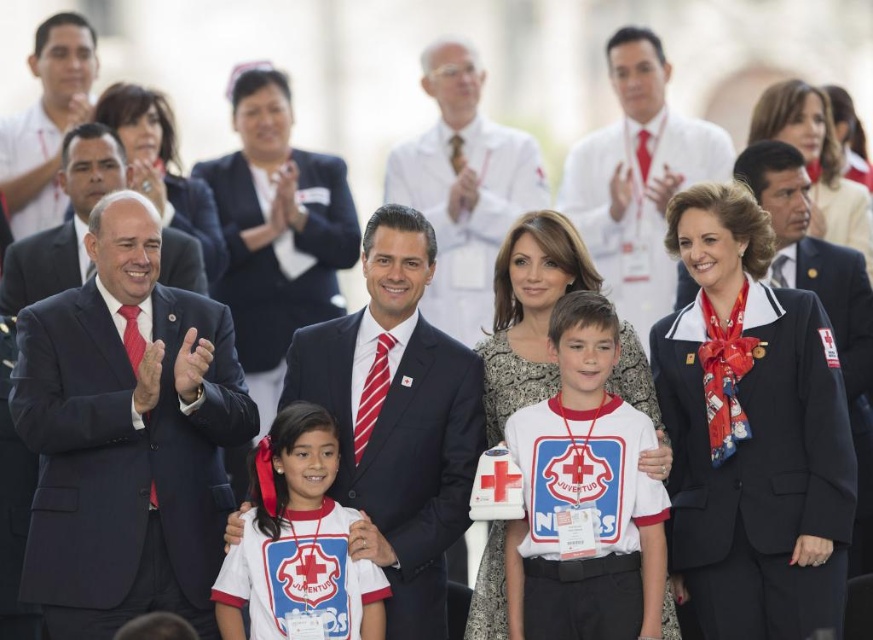
Question: Does matte black suit at center have a smaller size compared to white cotton shirt at center?

Choices:
 (A) no
 (B) yes

Answer: (A)

Question: From the image, what is the correct spatial relationship of matte black suit at left in relation to matte black suit at center?

Choices:
 (A) below
 (B) above

Answer: (B)

Question: Can you confirm if matte black suit at center is thinner than white jersey at center?

Choices:
 (A) yes
 (B) no

Answer: (B)

Question: Which point is closer to the camera?

Choices:
 (A) white cotton shirt at center
 (B) white jersey at center
 (C) matte black suit at left

Answer: (B)

Question: Based on their relative distances, which object is farther from the matte black suit at left?

Choices:
 (A) white cotton shirt at center
 (B) matte black suit at center
 (C) white jersey at center

Answer: (A)

Question: Which point is farther from the camera taking this photo?

Choices:
 (A) (572, 292)
 (B) (126, 323)
 (C) (296, 531)
 (D) (386, 544)

Answer: (A)